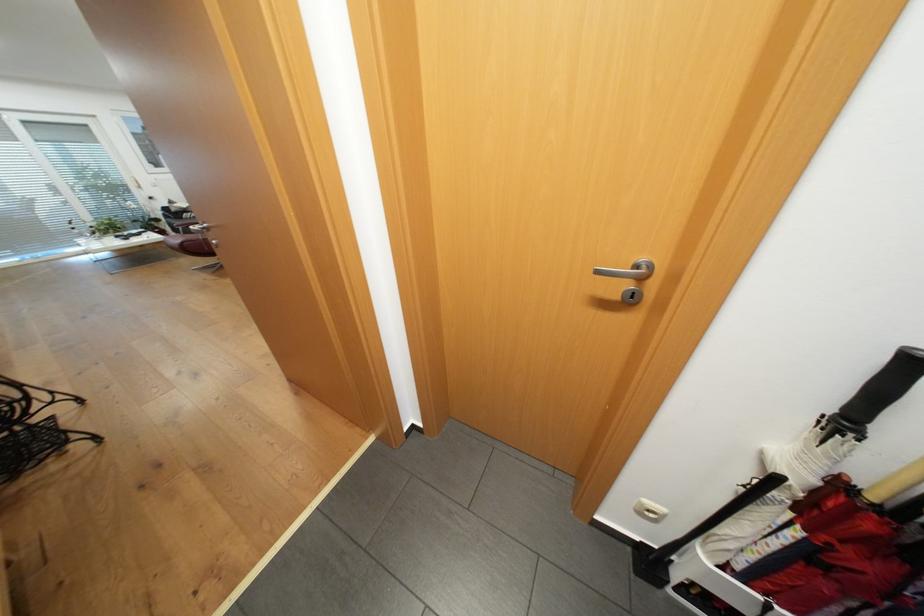
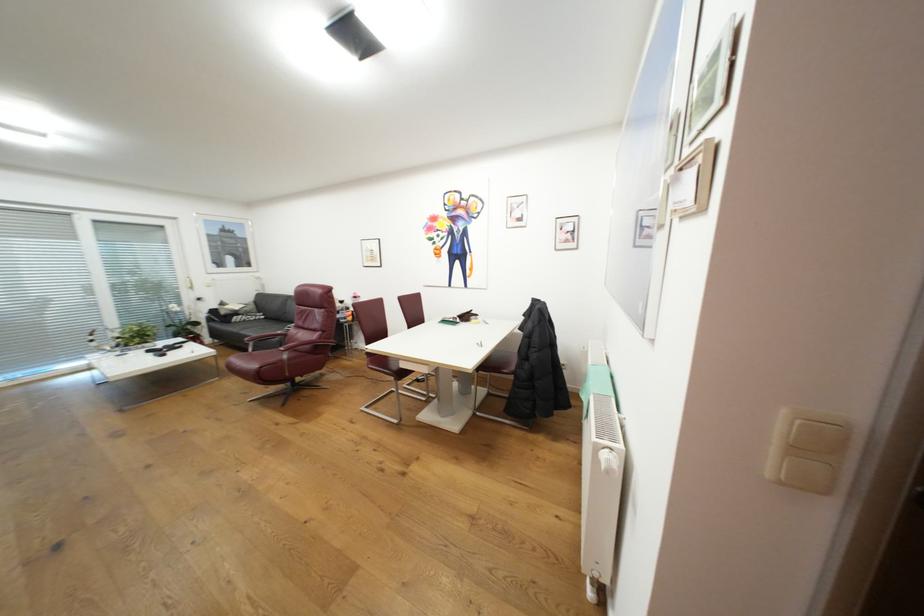
Which direction would the cameraman need to move to produce the second image?

The cameraman walked toward left, forward.